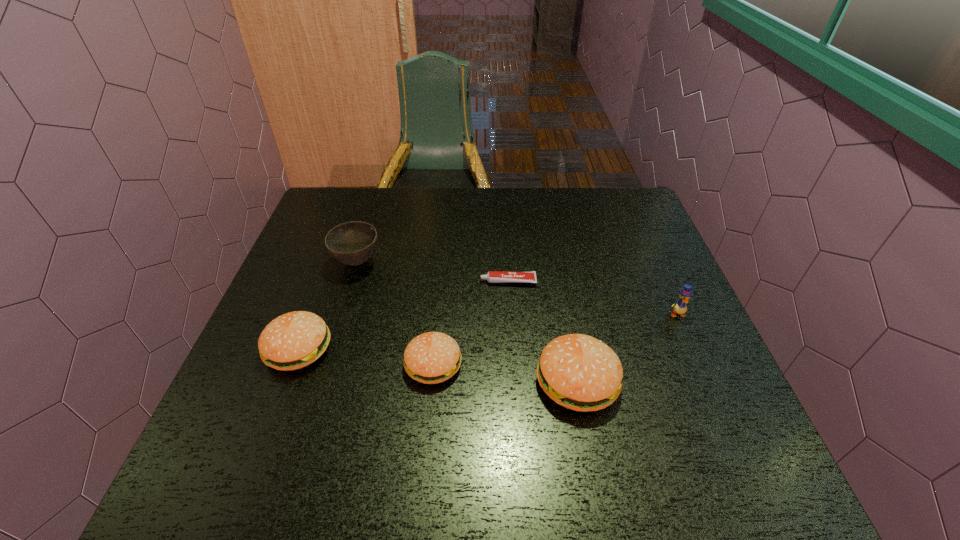
The image size is (960, 540). Identify the location of free space between the third shortest object and the bowl. (328, 306).

Locate an element on the screen. Image resolution: width=960 pixels, height=540 pixels. free space between the third farthest object and the toothpaste is located at coordinates point(592,298).

At what (x,y) coordinates should I click in order to perform the action: click on unoccupied area between the bowl and the shortest object. Please return your answer as a coordinate pair (x, y). Image resolution: width=960 pixels, height=540 pixels. Looking at the image, I should click on (433, 272).

Identify the location of vacant area that lies between the third farthest object and the bowl. coord(516,288).

Where is `free space between the second patty from left to right and the duckling`? The image size is (960, 540). free space between the second patty from left to right and the duckling is located at coordinates (555, 339).

You are a GUI agent. You are given a task and a screenshot of the screen. Output one action in this format:
    pyautogui.click(x=<x>, y=<y>)
    Task: Click on the free space between the third object from left to right and the rightmost object
    The width and height of the screenshot is (960, 540).
    Given the screenshot: What is the action you would take?
    pyautogui.click(x=555, y=339)

This screenshot has width=960, height=540. Find the location of `vacant area between the rightmost patty and the shortest object`. vacant area between the rightmost patty and the shortest object is located at coordinates (542, 331).

I want to click on object that stands as the second closest to the fourth nearest object, so click(x=492, y=276).

Identify the location of object that is the nearest to the duckling. (579, 372).

This screenshot has height=540, width=960. What are the coordinates of `patty identified as the third closest to the rightmost object` in the screenshot? It's located at (294, 340).